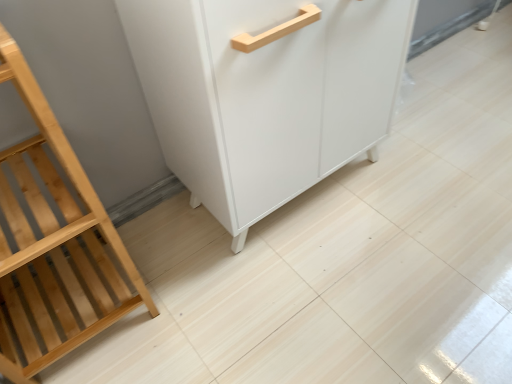
Question: Is white matte cabinet at center smaller than natural wood shelf at left?

Choices:
 (A) no
 (B) yes

Answer: (A)

Question: Is white matte cabinet at center facing towards natural wood shelf at left?

Choices:
 (A) no
 (B) yes

Answer: (A)

Question: Is white matte cabinet at center positioned in front of natural wood shelf at left?

Choices:
 (A) no
 (B) yes

Answer: (A)

Question: Can you confirm if white matte cabinet at center is taller than natural wood shelf at left?

Choices:
 (A) no
 (B) yes

Answer: (A)

Question: Does white matte cabinet at center have a larger size compared to natural wood shelf at left?

Choices:
 (A) yes
 (B) no

Answer: (A)

Question: Does white matte cabinet at center lie behind natural wood shelf at left?

Choices:
 (A) no
 (B) yes

Answer: (B)

Question: Considering the relative sizes of natural wood shelf at left and white matte cabinet at center in the image provided, is natural wood shelf at left shorter than white matte cabinet at center?

Choices:
 (A) no
 (B) yes

Answer: (A)

Question: Is natural wood shelf at left in front of white matte cabinet at center?

Choices:
 (A) yes
 (B) no

Answer: (A)

Question: From a real-world perspective, is natural wood shelf at left positioned over white matte cabinet at center based on gravity?

Choices:
 (A) yes
 (B) no

Answer: (A)

Question: Is natural wood shelf at left next to white matte cabinet at center?

Choices:
 (A) no
 (B) yes

Answer: (A)

Question: Is natural wood shelf at left behind white matte cabinet at center?

Choices:
 (A) no
 (B) yes

Answer: (A)

Question: Does natural wood shelf at left appear on the right side of white matte cabinet at center?

Choices:
 (A) no
 (B) yes

Answer: (A)

Question: Based on their positions, is natural wood shelf at left located to the left or right of white matte cabinet at center?

Choices:
 (A) right
 (B) left

Answer: (B)